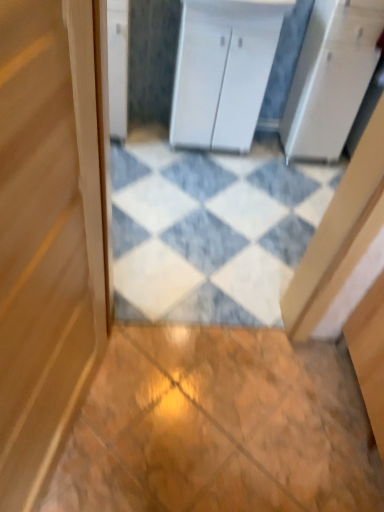
Question: Which direction should I rotate to face white marble tile at center, arranged as the 1th tile when viewed from the top, — up or down?

Choices:
 (A) down
 (B) up

Answer: (B)

Question: Is white matte cabinet at center, the first cabinetry positioned from the right, next to white marble tile at center, marked as the 1th tile in a back-to-front arrangement?

Choices:
 (A) yes
 (B) no

Answer: (B)

Question: Does white matte cabinet at center, the second cabinetry viewed from the left, have a greater width compared to white marble tile at center, arranged as the second tile when ordered from the bottom?

Choices:
 (A) yes
 (B) no

Answer: (B)

Question: Considering the relative sizes of white matte cabinet at center, the second cabinetry viewed from the left, and white marble tile at center, arranged as the second tile when ordered from the bottom, in the image provided, is white matte cabinet at center, the second cabinetry viewed from the left, smaller than white marble tile at center, arranged as the second tile when ordered from the bottom,?

Choices:
 (A) yes
 (B) no

Answer: (B)

Question: Considering the relative sizes of white matte cabinet at center, the first cabinetry positioned from the right, and white marble tile at center, which appears as the 2th tile when viewed from the front, in the image provided, is white matte cabinet at center, the first cabinetry positioned from the right, shorter than white marble tile at center, which appears as the 2th tile when viewed from the front,?

Choices:
 (A) yes
 (B) no

Answer: (B)

Question: Is white matte cabinet at center, the first cabinetry positioned from the right, facing away from white marble tile at center, which appears as the 2th tile when viewed from the front?

Choices:
 (A) no
 (B) yes

Answer: (A)

Question: Is white matte cabinet at center, the second cabinetry viewed from the left, taller than white marble tile at center, which appears as the 2th tile when viewed from the front?

Choices:
 (A) no
 (B) yes

Answer: (B)

Question: Are wooden tile at center, the second tile from the top, and white glossy cabinet at upper left, the second cabinetry viewed from the right, located far from each other?

Choices:
 (A) no
 (B) yes

Answer: (B)

Question: Is wooden tile at center, the first tile positioned from the front, looking in the opposite direction of white glossy cabinet at upper left, the second cabinetry viewed from the right?

Choices:
 (A) yes
 (B) no

Answer: (B)

Question: Can you confirm if wooden tile at center, the first tile positioned from the front, is taller than white glossy cabinet at upper left, the second cabinetry viewed from the right?

Choices:
 (A) no
 (B) yes

Answer: (A)

Question: Is wooden tile at center, the second tile from the top, next to white glossy cabinet at upper left, arranged as the first cabinetry when viewed from the left, and touching it?

Choices:
 (A) yes
 (B) no

Answer: (B)

Question: Is wooden tile at center, the second tile from the top, bigger than white glossy cabinet at upper left, arranged as the first cabinetry when viewed from the left?

Choices:
 (A) yes
 (B) no

Answer: (B)

Question: From a real-world perspective, is wooden tile at center, the first tile positioned from the front, physically above white glossy cabinet at upper left, the second cabinetry viewed from the right?

Choices:
 (A) no
 (B) yes

Answer: (A)

Question: Considering the relative sizes of white glossy cabinet at upper left, the second cabinetry viewed from the right, and wooden door at center in the image provided, is white glossy cabinet at upper left, the second cabinetry viewed from the right, bigger than wooden door at center?

Choices:
 (A) yes
 (B) no

Answer: (B)